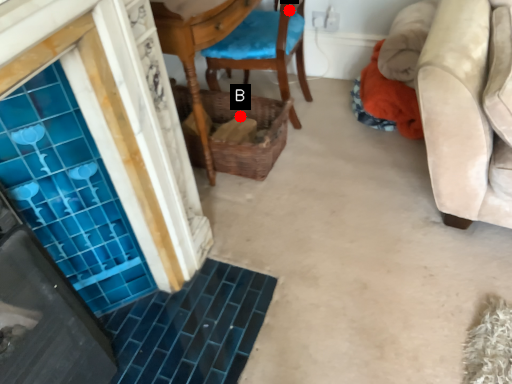
Question: Two points are circled on the image, labeled by A and B beside each circle. Which point is further to the camera?

Choices:
 (A) A is further
 (B) B is further

Answer: (B)